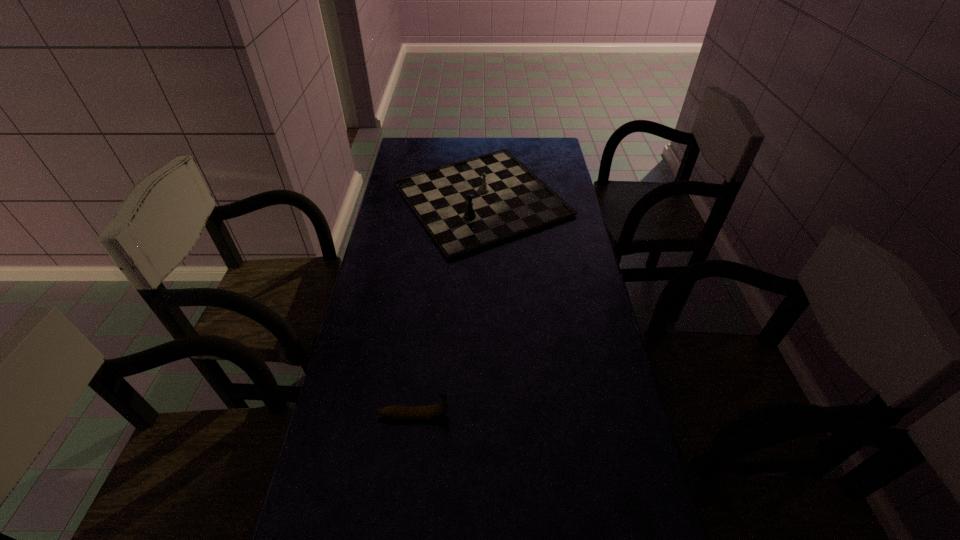
Identify the location of blank area at the far edge. The height and width of the screenshot is (540, 960). (451, 156).

Locate an element on the screen. The width and height of the screenshot is (960, 540). free region at the left edge of the desktop is located at coordinates (403, 274).

In order to click on vacant space at the right edge of the desktop in this screenshot , I will do `click(536, 175)`.

Find the location of a particular element. free region at the far right corner is located at coordinates (540, 153).

At what (x,y) coordinates should I click in order to perform the action: click on free spot between the banana and the gameboard. Please return your answer as a coordinate pair (x, y). Looking at the image, I should click on (447, 307).

Locate an element on the screen. The height and width of the screenshot is (540, 960). free spot between the gameboard and the nearer object is located at coordinates [x=447, y=307].